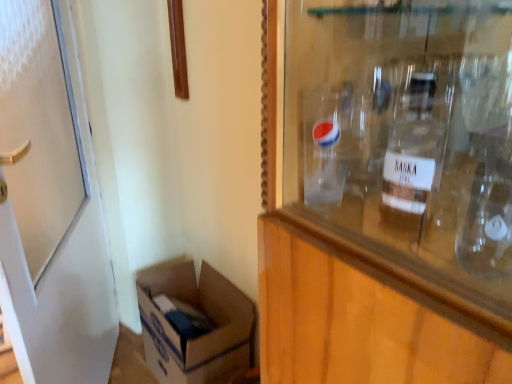
Question: Does white matte door at left have a greater width compared to white cardboard box at lower left?

Choices:
 (A) yes
 (B) no

Answer: (B)

Question: Considering the relative positions of white matte door at left and white cardboard box at lower left in the image provided, is white matte door at left in front of white cardboard box at lower left?

Choices:
 (A) no
 (B) yes

Answer: (B)

Question: Is white cardboard box at lower left surrounded by white matte door at left?

Choices:
 (A) no
 (B) yes

Answer: (A)

Question: From a real-world perspective, is white matte door at left located higher than white cardboard box at lower left?

Choices:
 (A) yes
 (B) no

Answer: (A)

Question: Considering the relative sizes of white matte door at left and white cardboard box at lower left in the image provided, is white matte door at left smaller than white cardboard box at lower left?

Choices:
 (A) no
 (B) yes

Answer: (A)

Question: Does white matte door at left have a lesser height compared to white cardboard box at lower left?

Choices:
 (A) no
 (B) yes

Answer: (A)

Question: Can you confirm if white cardboard box at lower left is shorter than clear glass bottle at upper right?

Choices:
 (A) no
 (B) yes

Answer: (A)

Question: Is white cardboard box at lower left wider than clear glass bottle at upper right?

Choices:
 (A) no
 (B) yes

Answer: (B)

Question: Considering the relative sizes of white cardboard box at lower left and clear glass bottle at upper right in the image provided, is white cardboard box at lower left bigger than clear glass bottle at upper right?

Choices:
 (A) yes
 (B) no

Answer: (A)

Question: Does white cardboard box at lower left lie behind clear glass bottle at upper right?

Choices:
 (A) yes
 (B) no

Answer: (A)

Question: From a real-world perspective, is white cardboard box at lower left positioned over clear glass bottle at upper right based on gravity?

Choices:
 (A) no
 (B) yes

Answer: (A)

Question: Considering the relative sizes of white cardboard box at lower left and clear glass bottle at upper right in the image provided, is white cardboard box at lower left taller than clear glass bottle at upper right?

Choices:
 (A) yes
 (B) no

Answer: (A)

Question: Is clear glass bottle at upper right positioned far away from white matte door at left?

Choices:
 (A) yes
 (B) no

Answer: (A)